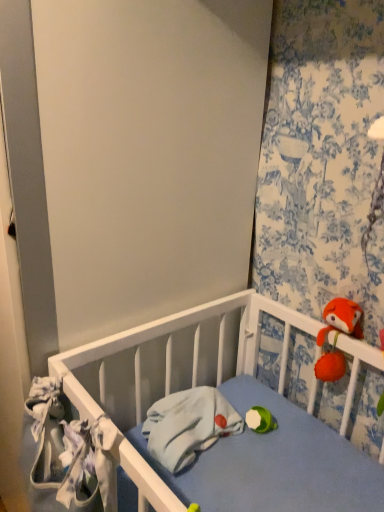
Question: From the image's perspective, is fluffy orange plush at upper right on top of floral fabric curtain at upper right?

Choices:
 (A) no
 (B) yes

Answer: (A)

Question: Is fluffy orange plush at upper right positioned in front of floral fabric curtain at upper right?

Choices:
 (A) yes
 (B) no

Answer: (B)

Question: From a real-world perspective, is fluffy orange plush at upper right beneath floral fabric curtain at upper right?

Choices:
 (A) yes
 (B) no

Answer: (A)

Question: Considering the relative sizes of fluffy orange plush at upper right and floral fabric curtain at upper right in the image provided, is fluffy orange plush at upper right taller than floral fabric curtain at upper right?

Choices:
 (A) no
 (B) yes

Answer: (A)

Question: Is fluffy orange plush at upper right oriented towards floral fabric curtain at upper right?

Choices:
 (A) no
 (B) yes

Answer: (A)

Question: Is fluffy orange plush at upper right shorter than floral fabric curtain at upper right?

Choices:
 (A) no
 (B) yes

Answer: (B)

Question: Can you confirm if white fabric at left, marked as the 2th material in a back-to-front arrangement, is thinner than fluffy orange plush at upper right?

Choices:
 (A) yes
 (B) no

Answer: (B)

Question: From a real-world perspective, is white fabric at left, which is counted as the first material, starting from the left, physically above fluffy orange plush at upper right?

Choices:
 (A) no
 (B) yes

Answer: (A)

Question: Is white fabric at left, arranged as the second material when viewed from the right, positioned far away from fluffy orange plush at upper right?

Choices:
 (A) no
 (B) yes

Answer: (A)

Question: Is fluffy orange plush at upper right at the back of white fabric at left, arranged as the second material when viewed from the right?

Choices:
 (A) yes
 (B) no

Answer: (A)

Question: Can you confirm if white fabric at left, arranged as the second material when viewed from the right, is smaller than fluffy orange plush at upper right?

Choices:
 (A) yes
 (B) no

Answer: (B)

Question: Is white fabric at left, which is counted as the first material, starting from the left, at the left side of fluffy orange plush at upper right?

Choices:
 (A) no
 (B) yes

Answer: (B)

Question: Is light blue fabric at center, which is the 1th material in back-to-front order, positioned with its back to fluffy orange plush at upper right?

Choices:
 (A) yes
 (B) no

Answer: (B)